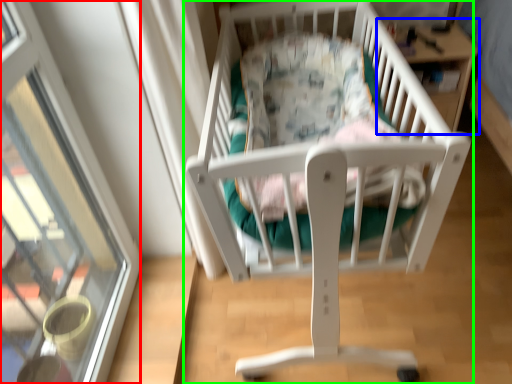
Question: Considering the real-world distances, which object is closest to glass door (highlighted by a red box)? table (highlighted by a blue box) or infant bed (highlighted by a green box).

Choices:
 (A) table
 (B) infant bed

Answer: (B)